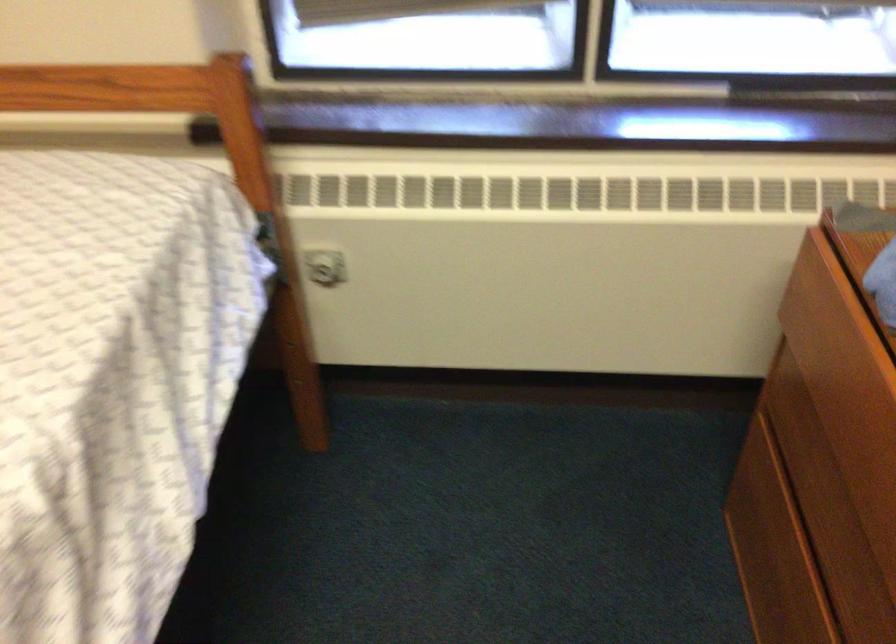
Locate an element on the screen. The width and height of the screenshot is (896, 644). radiator dial is located at coordinates (323, 267).